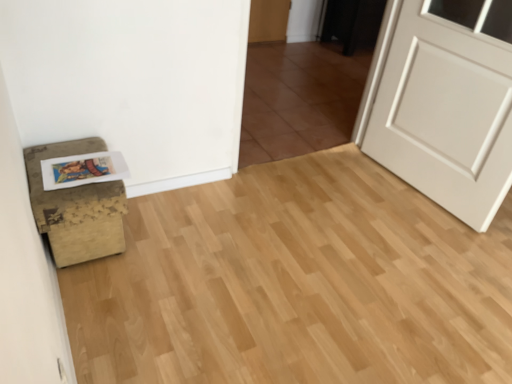
You are a GUI agent. You are given a task and a screenshot of the screen. Output one action in this format:
    pyautogui.click(x=<x>, y=<y>)
    Task: Click on the free space above distressed brown ottoman at lower left (from a real-world perspective)
    
    Given the screenshot: What is the action you would take?
    pyautogui.click(x=73, y=163)